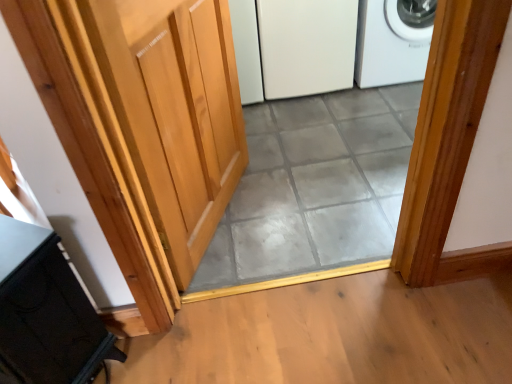
Locate an element on the screen. empty space that is to the right of light wood door at center is located at coordinates (303, 196).